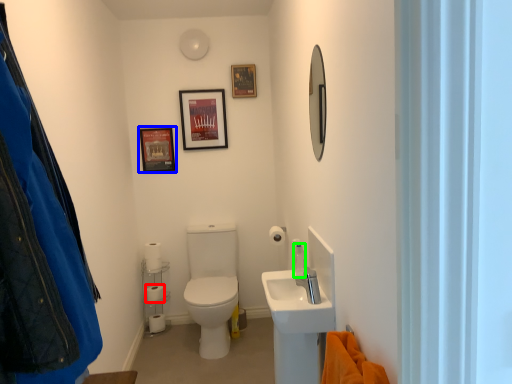
Question: Which is nearer to the toilet paper (highlighted by a red box)? picture frame (highlighted by a blue box) or toiletry (highlighted by a green box).

Choices:
 (A) picture frame
 (B) toiletry

Answer: (A)